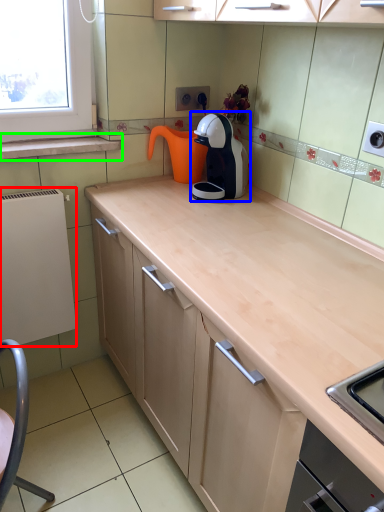
Question: Based on their relative distances, which object is farther from appliance (highlighted by a red box)? Choose from kitchen appliance (highlighted by a blue box) and window sill (highlighted by a green box).

Choices:
 (A) kitchen appliance
 (B) window sill

Answer: (A)